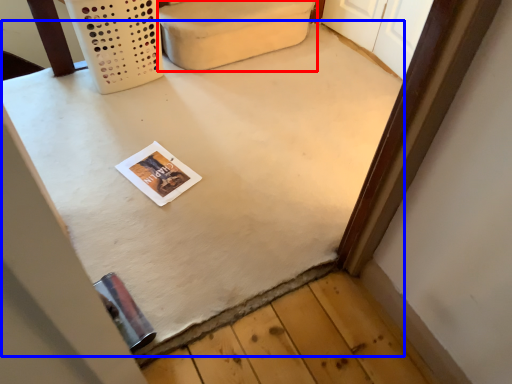
Question: Among these objects, which one is farthest to the camera, furniture (highlighted by a red box) or table (highlighted by a blue box)?

Choices:
 (A) furniture
 (B) table

Answer: (A)